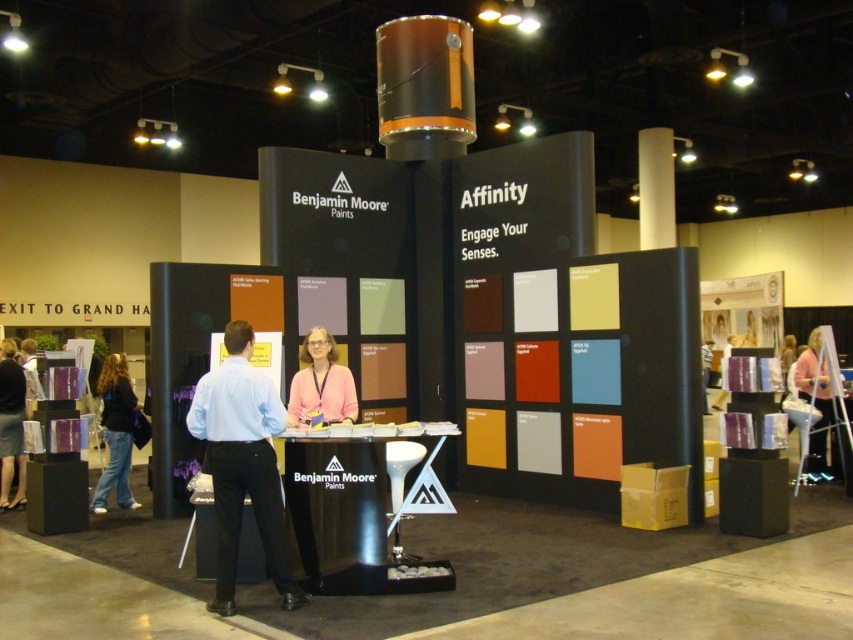
Between pink fabric at right and pink fabric at center, which one is positioned higher?

pink fabric at center is higher up.

Does pink fabric at right appear on the left side of pink fabric at center?

In fact, pink fabric at right is to the right of pink fabric at center.

Who is more distant from viewer, (828, 342) or (305, 390)?

The point (828, 342) is behind.

The image size is (853, 640). I want to click on pink fabric at right, so click(x=822, y=401).

Which is in front, point (115, 378) or point (317, 337)?

Positioned in front is point (317, 337).

Who is positioned more to the right, denim jeans at lower left or pink fabric at center?

Positioned to the right is pink fabric at center.

Is point (128, 451) positioned in front of point (300, 404)?

No, it is not.

The height and width of the screenshot is (640, 853). Identify the location of denim jeans at lower left. (115, 433).

Can you confirm if light blue shirt at center is positioned below pink fabric at center?

Yes, light blue shirt at center is below pink fabric at center.

Does point (225, 490) come in front of point (300, 397)?

Yes, it is.

Locate an element on the screen. The image size is (853, 640). light blue shirt at center is located at coordinates (242, 465).

Identify the location of light blue shirt at center. This screenshot has height=640, width=853. (242, 465).